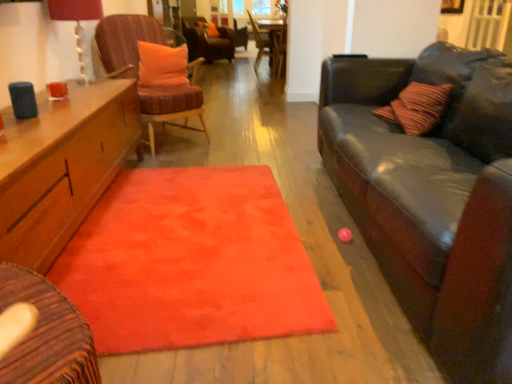
Where is `vacant region below fluffy orange rug at center (from a real-world perspective)`? The width and height of the screenshot is (512, 384). vacant region below fluffy orange rug at center (from a real-world perspective) is located at coordinates (196, 260).